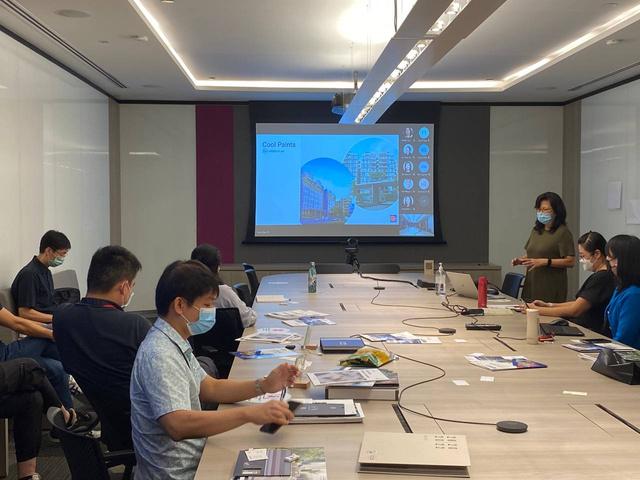
Where is `speakers`? The height and width of the screenshot is (480, 640). speakers is located at coordinates (58, 15), (140, 86), (541, 92).